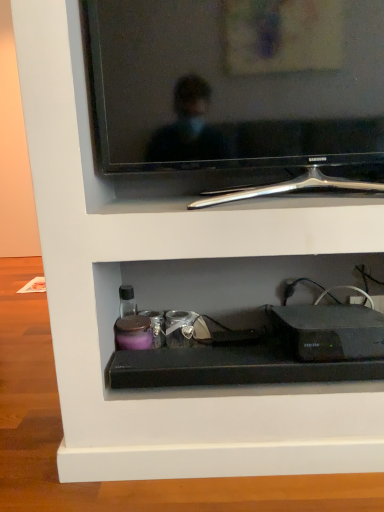
What is the approximate width of black plastic router at lower center?

10.27 inches.

What do you see at coordinates (329, 331) in the screenshot? I see `black plastic router at lower center` at bounding box center [329, 331].

Locate an element on the screen. This screenshot has width=384, height=512. black plastic router at lower center is located at coordinates (329, 331).

Image resolution: width=384 pixels, height=512 pixels. Describe the element at coordinates (237, 83) in the screenshot. I see `black glossy tv at upper center` at that location.

Locate an element on the screen. The height and width of the screenshot is (512, 384). black glossy tv at upper center is located at coordinates (237, 83).

The height and width of the screenshot is (512, 384). Identify the location of black plastic router at lower center. (329, 331).

In the scene shown: Between black glossy tv at upper center and black plastic router at lower center, which one appears on the right side from the viewer's perspective?

black plastic router at lower center is more to the right.

Who is more distant, black glossy tv at upper center or black plastic router at lower center?

black plastic router at lower center is further away from the camera.

Between point (152, 19) and point (297, 335), which one is positioned in front?

The point (152, 19) is closer.

From the image's perspective, would you say black glossy tv at upper center is shown under black plastic router at lower center?

Actually, black glossy tv at upper center appears above black plastic router at lower center in the image.

From a real-world perspective, relative to black plastic router at lower center, is black glossy tv at upper center vertically above or below?

black glossy tv at upper center is above black plastic router at lower center.

Considering the sizes of objects black glossy tv at upper center and black plastic router at lower center in the image provided, who is thinner, black glossy tv at upper center or black plastic router at lower center?

black glossy tv at upper center.

Is black glossy tv at upper center taller or shorter than black plastic router at lower center?

Considering their sizes, black glossy tv at upper center has more height than black plastic router at lower center.

Is black glossy tv at upper center bigger than black plastic router at lower center?

Indeed, black glossy tv at upper center has a larger size compared to black plastic router at lower center.

Is black glossy tv at upper center located outside black plastic router at lower center?

Yes, black glossy tv at upper center is located beyond the bounds of black plastic router at lower center.

Are black glossy tv at upper center and black plastic router at lower center located far from each other?

That's not correct — black glossy tv at upper center is a little close to black plastic router at lower center.

Is black glossy tv at upper center oriented towards black plastic router at lower center?

No, black glossy tv at upper center is not oriented towards black plastic router at lower center.

Locate an element on the screen. Image resolution: width=384 pixels, height=512 pixels. television above the black plastic router at lower center (from a real-world perspective) is located at coordinates (237, 83).

Considering the relative positions of black plastic router at lower center and black glossy tv at upper center in the image provided, is black plastic router at lower center to the right of black glossy tv at upper center from the viewer's perspective?

Yes.

In the scene shown: Is black plastic router at lower center positioned in front of black glossy tv at upper center?

No, it is not.

Which is further, (379, 317) or (168, 98)?

The point (379, 317) is farther from the camera.

From the image's perspective, which object appears higher, black plastic router at lower center or black glossy tv at upper center?

black glossy tv at upper center, from the image's perspective.

From a real-world perspective, is black plastic router at lower center positioned above or below black glossy tv at upper center?

Clearly, from a real-world perspective, black plastic router at lower center is below black glossy tv at upper center.

Considering the sizes of black plastic router at lower center and black glossy tv at upper center in the image, is black plastic router at lower center wider or thinner than black glossy tv at upper center?

Clearly, black plastic router at lower center has more width compared to black glossy tv at upper center.

Based on the photo, which of these two, black plastic router at lower center or black glossy tv at upper center, stands taller?

With more height is black glossy tv at upper center.

Looking at the image, does black plastic router at lower center seem bigger or smaller compared to black glossy tv at upper center?

Clearly, black plastic router at lower center is smaller in size than black glossy tv at upper center.

Is black plastic router at lower center surrounding black glossy tv at upper center?

No, black glossy tv at upper center is not a part of black plastic router at lower center.

Consider the image. Is black plastic router at lower center positioned far away from black glossy tv at upper center?

No, black plastic router at lower center is not far away from black glossy tv at upper center.

Does black plastic router at lower center turn towards black glossy tv at upper center?

No, black plastic router at lower center is not facing towards black glossy tv at upper center.

What's the angular difference between black plastic router at lower center and black glossy tv at upper center's facing directions?

6.37 degrees.

Find the location of a particular element. The width and height of the screenshot is (384, 512). gadget below the black glossy tv at upper center (from the image's perspective) is located at coordinates (329, 331).

Identify the location of gadget behind the black glossy tv at upper center. The height and width of the screenshot is (512, 384). (329, 331).

The image size is (384, 512). Identify the location of television located above the black plastic router at lower center (from a real-world perspective). (237, 83).